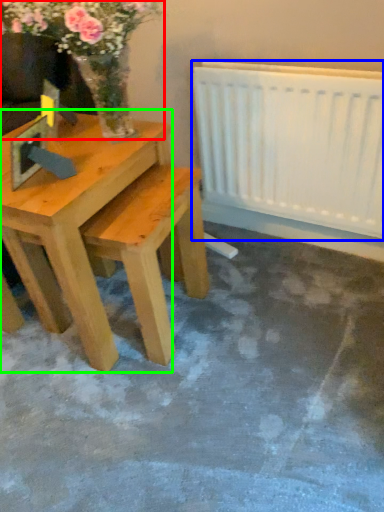
Question: Considering the real-world distances, which object is farthest from floral arrangement (highlighted by a red box)? radiator (highlighted by a blue box) or table (highlighted by a green box)?

Choices:
 (A) radiator
 (B) table

Answer: (A)